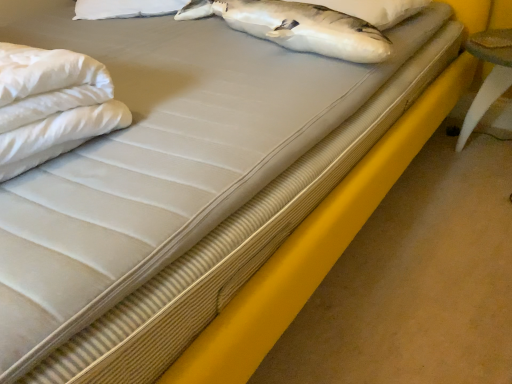
Question: Visually, is white soft pillow at upper center positioned to the left or to the right of white soft fabric at left?

Choices:
 (A) right
 (B) left

Answer: (A)

Question: From a real-world perspective, is white soft pillow at upper center positioned above or below white soft fabric at left?

Choices:
 (A) below
 (B) above

Answer: (A)

Question: Which is correct: white soft pillow at upper center is inside white soft fabric at left, or outside of it?

Choices:
 (A) inside
 (B) outside

Answer: (B)

Question: From a real-world perspective, is white soft fabric at left positioned above or below white soft pillow at upper center?

Choices:
 (A) above
 (B) below

Answer: (A)

Question: From the image's perspective, is white soft fabric at left positioned above or below white soft pillow at upper center?

Choices:
 (A) below
 (B) above

Answer: (A)

Question: In terms of height, does white soft fabric at left look taller or shorter compared to white soft pillow at upper center?

Choices:
 (A) tall
 (B) short

Answer: (A)

Question: Based on their sizes in the image, would you say white soft fabric at left is bigger or smaller than white soft pillow at upper center?

Choices:
 (A) small
 (B) big

Answer: (B)